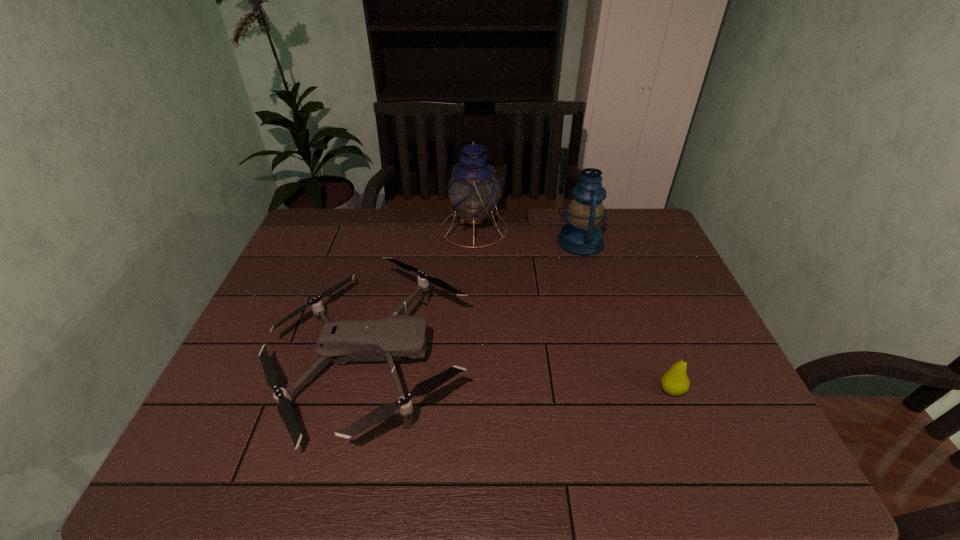
Find the location of a particular element. The width and height of the screenshot is (960, 540). the tallest object is located at coordinates (473, 190).

The image size is (960, 540). I want to click on the taller lantern, so click(x=473, y=190).

Where is `the third shortest object`? The width and height of the screenshot is (960, 540). the third shortest object is located at coordinates (582, 236).

You are a GUI agent. You are given a task and a screenshot of the screen. Output one action in this format:
    pyautogui.click(x=<x>, y=<y>)
    Task: Click on the third object from left to right
    This screenshot has width=960, height=540.
    Given the screenshot: What is the action you would take?
    pyautogui.click(x=582, y=236)

Identify the location of the rightmost object. Image resolution: width=960 pixels, height=540 pixels. (674, 382).

Where is `drone`? drone is located at coordinates (389, 339).

You are a GUI agent. You are given a task and a screenshot of the screen. Output one action in this format:
    pyautogui.click(x=<x>, y=<y>)
    Task: Click on the vacant region located on the front-facing side of the left lantern
    This screenshot has width=960, height=540.
    Given the screenshot: What is the action you would take?
    pyautogui.click(x=606, y=228)

Locate an element on the screen. The image size is (960, 540). free spot located 0.310m on the face of the right lantern is located at coordinates [x=464, y=242].

Where is `free space located 0.330m on the face of the right lantern`? free space located 0.330m on the face of the right lantern is located at coordinates (458, 242).

Find the location of a particular element. Image resolution: width=960 pixels, height=540 pixels. free point located 0.070m on the face of the right lantern is located at coordinates (536, 242).